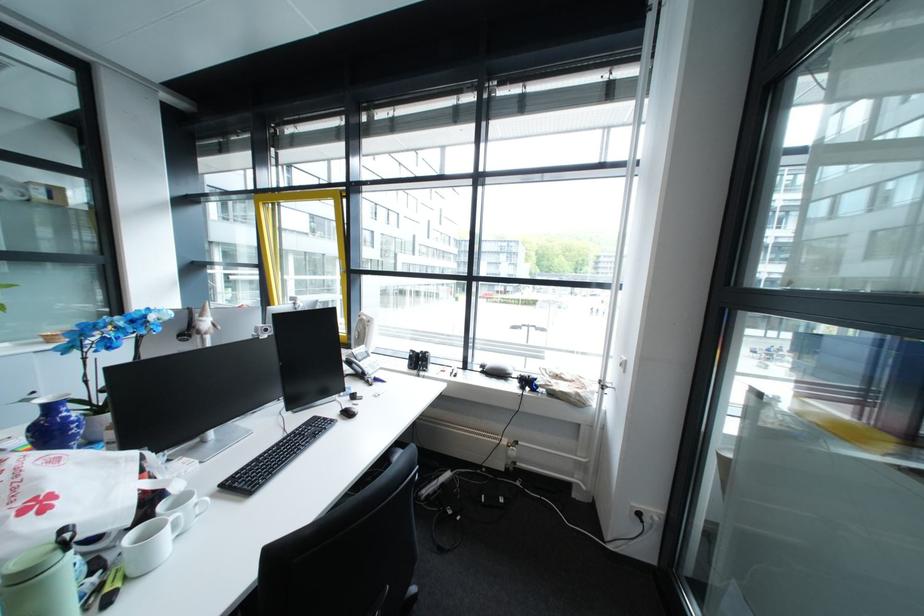
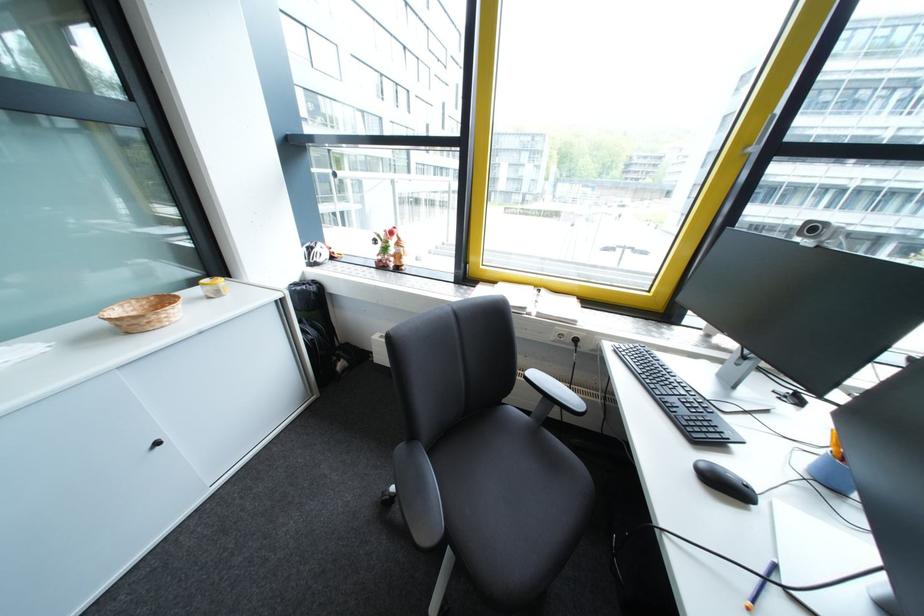
In a continuous first-person perspective shot, in which direction is the camera moving?

The cameraman moved toward left, forward.